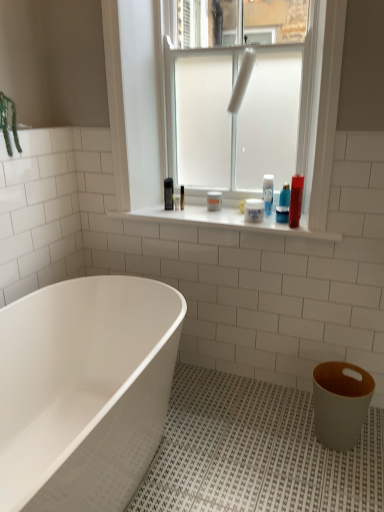
In order to click on vacant space in white frosted glass at center (from a real-world perspective) in this screenshot , I will do `click(214, 218)`.